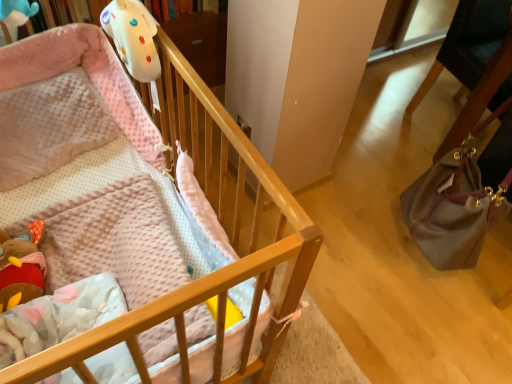
Question: Should I look upward or downward to see wooden crib at upper left?

Choices:
 (A) up
 (B) down

Answer: (A)

Question: Does matte brown handbag at right lie in front of wooden crib at upper left?

Choices:
 (A) yes
 (B) no

Answer: (B)

Question: Considering the relative positions of matte brown handbag at right and wooden crib at upper left in the image provided, is matte brown handbag at right to the right of wooden crib at upper left from the viewer's perspective?

Choices:
 (A) no
 (B) yes

Answer: (B)

Question: From the image's perspective, would you say matte brown handbag at right is positioned over wooden crib at upper left?

Choices:
 (A) no
 (B) yes

Answer: (B)

Question: From a real-world perspective, is matte brown handbag at right physically above wooden crib at upper left?

Choices:
 (A) no
 (B) yes

Answer: (B)

Question: Would you say matte brown handbag at right is outside wooden crib at upper left?

Choices:
 (A) no
 (B) yes

Answer: (B)

Question: From the image's perspective, is matte brown handbag at right under wooden crib at upper left?

Choices:
 (A) yes
 (B) no

Answer: (B)

Question: Could you tell me if wooden crib at upper left is turned towards matte brown handbag at right?

Choices:
 (A) yes
 (B) no

Answer: (B)

Question: From a real-world perspective, is wooden crib at upper left physically above matte brown handbag at right?

Choices:
 (A) yes
 (B) no

Answer: (B)

Question: From a real-world perspective, is wooden crib at upper left positioned under matte brown handbag at right based on gravity?

Choices:
 (A) no
 (B) yes

Answer: (B)

Question: From the image's perspective, would you say wooden crib at upper left is positioned over matte brown handbag at right?

Choices:
 (A) no
 (B) yes

Answer: (A)

Question: Considering the relative positions of wooden crib at upper left and matte brown handbag at right in the image provided, is wooden crib at upper left to the right of matte brown handbag at right from the viewer's perspective?

Choices:
 (A) yes
 (B) no

Answer: (B)

Question: Can you confirm if wooden crib at upper left is bigger than matte brown handbag at right?

Choices:
 (A) yes
 (B) no

Answer: (A)

Question: Looking at their shapes, would you say matte brown handbag at right is wider or thinner than wooden crib at upper left?

Choices:
 (A) thin
 (B) wide

Answer: (A)